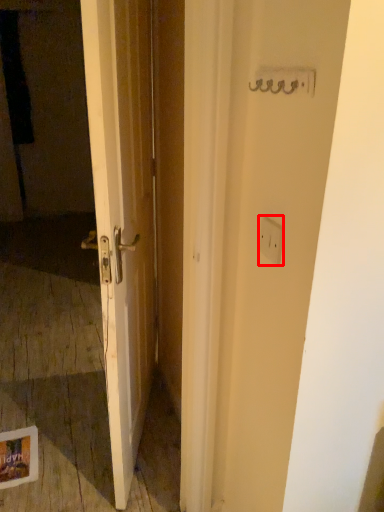
Question: Observing the image, what is the correct spatial positioning of electric outlet (annotated by the red box) in reference to screen door?

Choices:
 (A) left
 (B) right

Answer: (B)